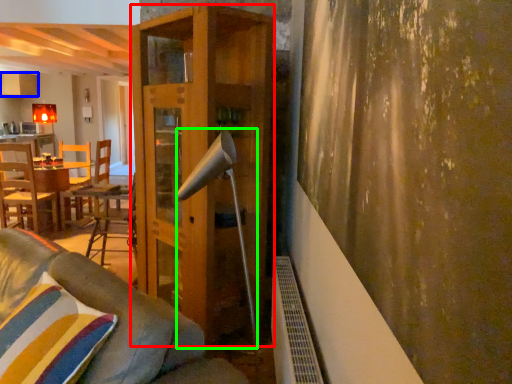
Question: Considering the real-world distances, which object is farthest from shelf (highlighted by a red box)? cabinetry (highlighted by a blue box) or lamp (highlighted by a green box)?

Choices:
 (A) cabinetry
 (B) lamp

Answer: (A)